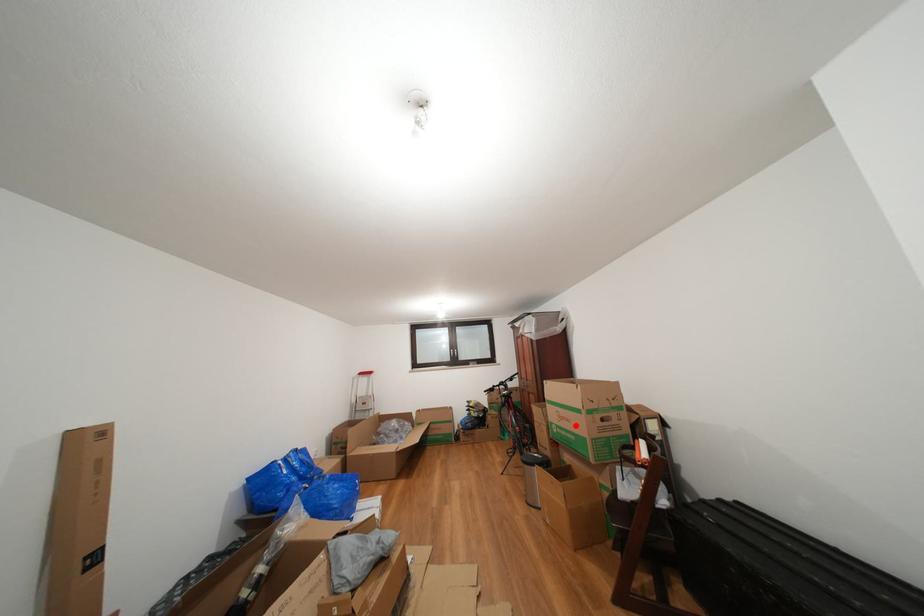
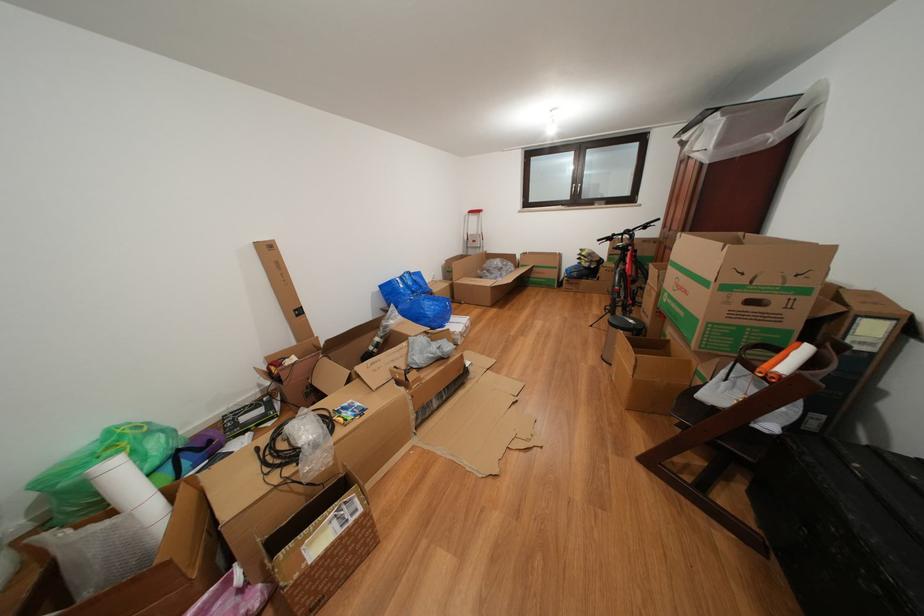
Find the pixel in the second image that matches the highlighted location in the first image.

(694, 297)